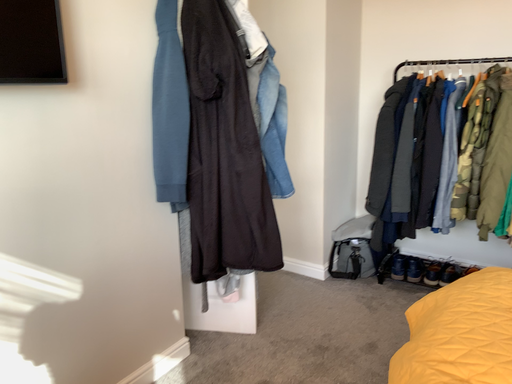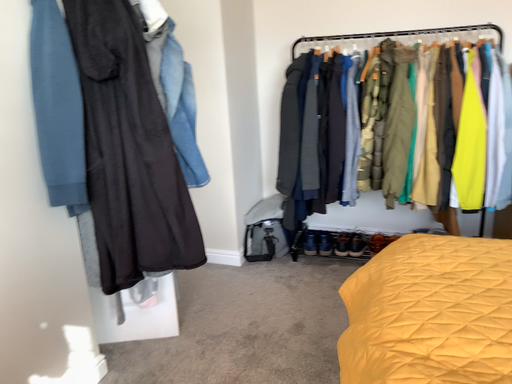
Question: Which way did the camera rotate in the video?

Choices:
 (A) rotated left
 (B) rotated right

Answer: (B)